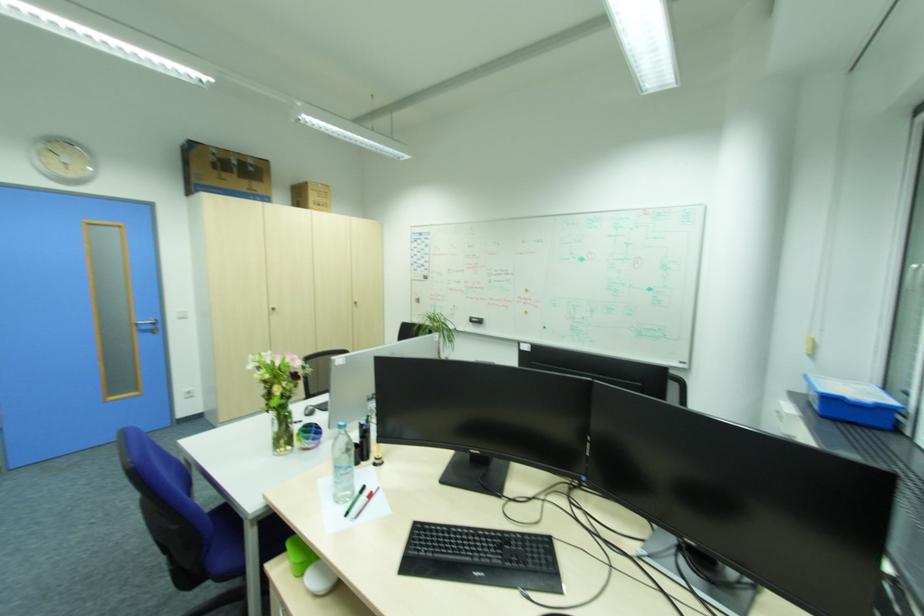
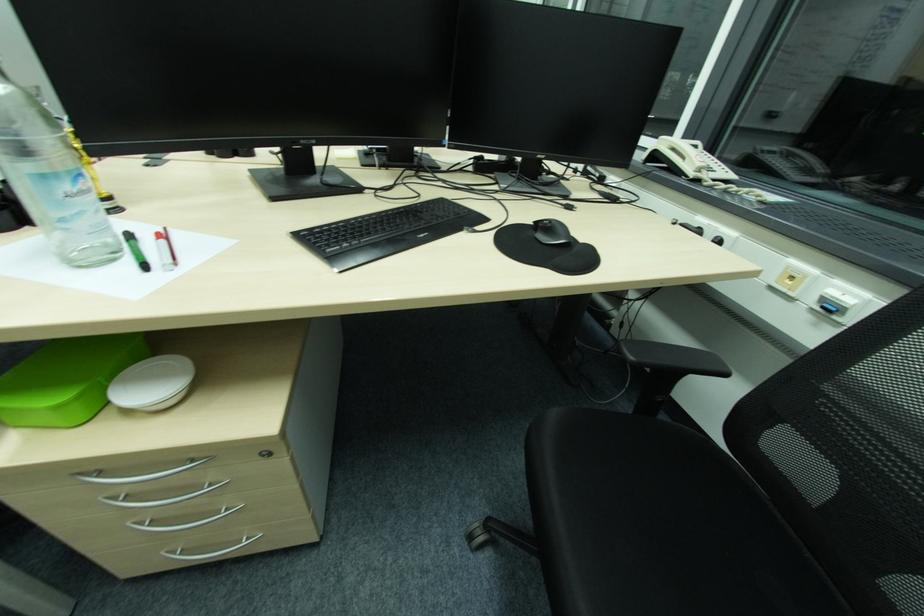
Locate, in the second image, the point that corresponds to (306,564) in the first image.

(84, 395)